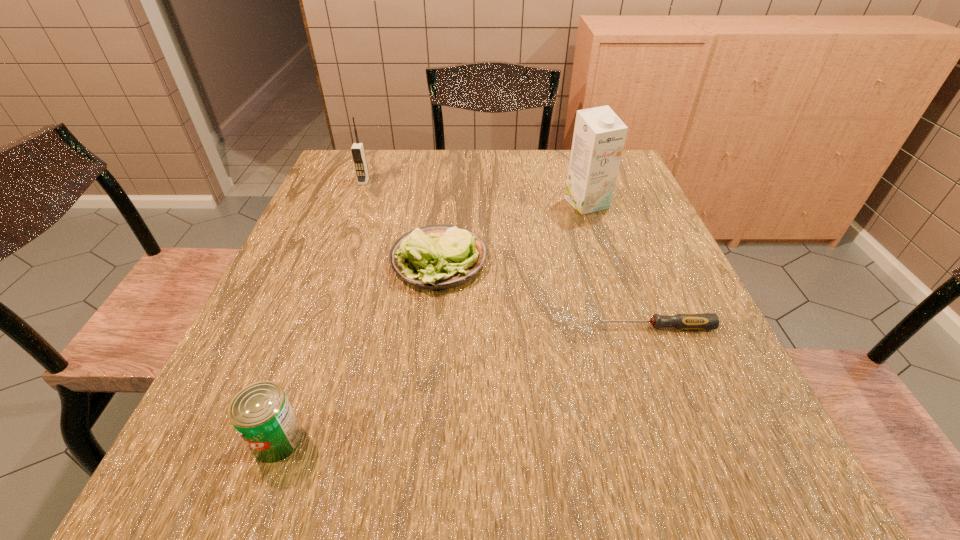
Locate an element on the screen. The image size is (960, 540). free space at the near left corner of the desktop is located at coordinates (266, 478).

Find the location of `free region at the near right corner`. free region at the near right corner is located at coordinates (695, 478).

Find the location of a particular element. Image resolution: width=960 pixels, height=540 pixels. unoccupied area between the fourth farthest object and the nearest object is located at coordinates (467, 383).

Where is `vacant point located between the carton and the cellular telephone`? The height and width of the screenshot is (540, 960). vacant point located between the carton and the cellular telephone is located at coordinates (475, 192).

You are a GUI agent. You are given a task and a screenshot of the screen. Output one action in this format:
    pyautogui.click(x=<x>, y=<y>)
    Task: Click on the free area in between the cellular telephone and the lettuce
    
    Given the screenshot: What is the action you would take?
    pyautogui.click(x=401, y=221)

Identify the location of free spot between the third tallest object and the second shortest object. (358, 350).

The height and width of the screenshot is (540, 960). Find the location of `free point between the third nearest object and the shortest object`. free point between the third nearest object and the shortest object is located at coordinates (547, 294).

Where is `empty location between the cellular telephone and the fourth nearest object`? The width and height of the screenshot is (960, 540). empty location between the cellular telephone and the fourth nearest object is located at coordinates (475, 192).

Locate an element on the screen. unoccupied position between the second farthest object and the screwdriver is located at coordinates (621, 265).

Where is `free space between the fourth tallest object and the fourth shortest object`? This screenshot has width=960, height=540. free space between the fourth tallest object and the fourth shortest object is located at coordinates pyautogui.click(x=401, y=221).